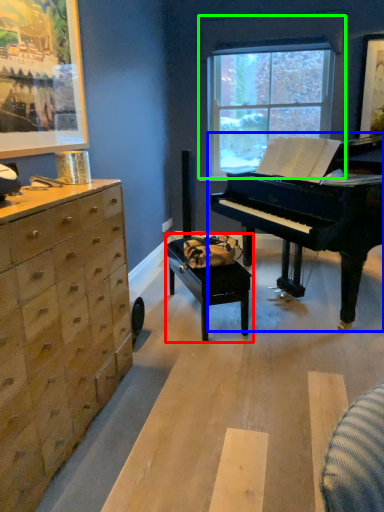
Question: Which object is positioned closest to table (highlighted by a red box)? Select from piano (highlighted by a blue box) and window (highlighted by a green box).

Choices:
 (A) piano
 (B) window

Answer: (A)